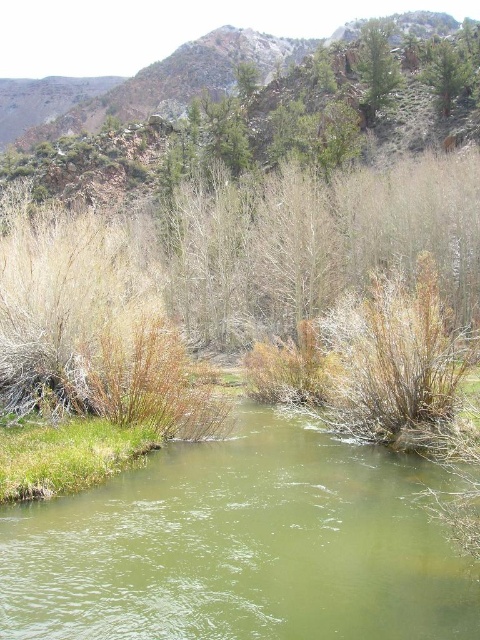
You are standing at the center of the river and want to reach the green leafy tree at upper right. Which direction should you head towards from the green grassy bank at lower left?

You should head towards the right from the green grassy bank at lower left to reach the green leafy tree at upper right since the green grassy bank at lower left is positioned on the left side of the green leafy tree at upper right.

You are planning to set up a small tent for a camping trip. You have two options for locations in the image provided. The first is on the green grassy bank at lower left, and the second is near the green leafy tree at upper right. Considering the size of the areas, which location would allow for more space to comfortably set up your tent?

The green leafy tree at upper right is larger in size compared to the green grassy bank at lower left, so setting up the tent near the green leafy tree at upper right would provide more space.